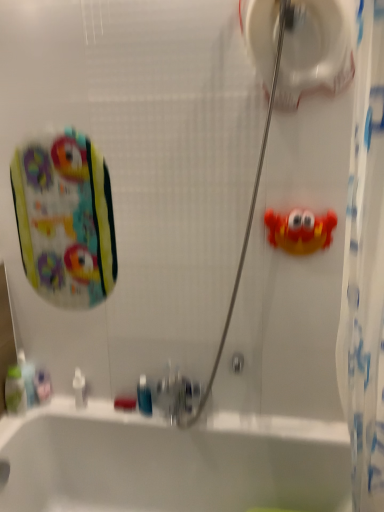
Question: In terms of height, does white plastic bottle at lower left look taller or shorter compared to translucent plastic mouthwash at lower left, which is the 2th mouthwash from left to right?

Choices:
 (A) short
 (B) tall

Answer: (A)

Question: From a real-world perspective, relative to translucent plastic mouthwash at lower left, which is the 2th mouthwash from left to right, is white plastic bottle at lower left vertically above or below?

Choices:
 (A) below
 (B) above

Answer: (A)

Question: Which is farther from the white glossy bathtub at lower center?

Choices:
 (A) rubber crab at right
 (B) white plastic bottle at lower left
 (C) clear plastic mouthwash at lower left, marked as the 2th mouthwash in a right-to-left arrangement
 (D) translucent plastic mouthwash at lower left, which is the 2th mouthwash from left to right
 (E) blue translucent mouthwash at lower center, positioned as the 1th mouthwash in right-to-left order

Answer: (A)

Question: Considering the real-world distances, which object is farthest from the green plastic mouthwash at lower left, which is the 4th mouthwash in right-to-left order?

Choices:
 (A) blue translucent mouthwash at lower center, positioned as the 1th mouthwash in right-to-left order
 (B) white glossy toilet paper at upper center
 (C) white plastic bottle at lower left
 (D) clear plastic mouthwash at lower left, marked as the 2th mouthwash in a right-to-left arrangement
 (E) rubber crab at right

Answer: (B)